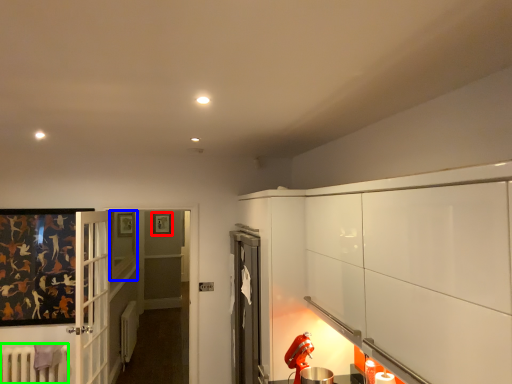
Question: Based on their relative distances, which object is farther from picture frame (highlighted by a red box)? Choose from window (highlighted by a blue box) and radiator (highlighted by a green box).

Choices:
 (A) window
 (B) radiator

Answer: (B)